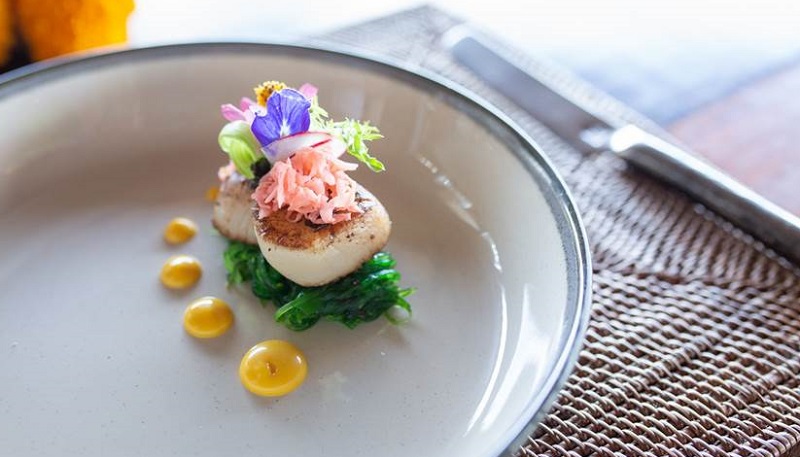
The width and height of the screenshot is (800, 457). I want to click on bowl rim, so click(x=128, y=58).